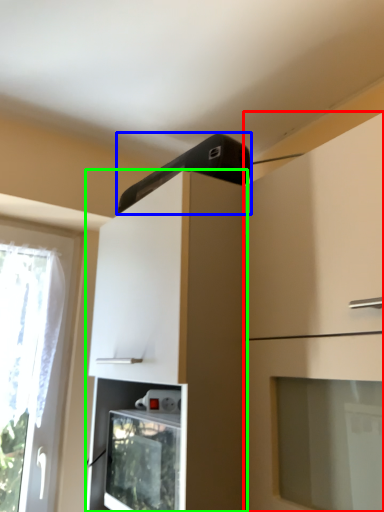
Question: Based on their relative distances, which object is nearer to cabinetry (highlighted by a red box)? Choose from appliance (highlighted by a blue box) and cabinetry (highlighted by a green box).

Choices:
 (A) appliance
 (B) cabinetry

Answer: (B)